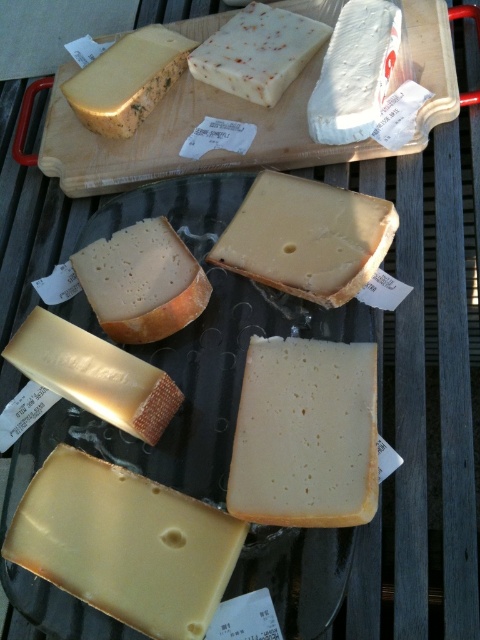
Is yellowish matte cheese at center-left above hard cheese at center?

Yes, yellowish matte cheese at center-left is above hard cheese at center.

Between yellowish matte cheese at center-left and hard cheese at center, which one has more height?

With more height is yellowish matte cheese at center-left.

Find the location of a particular element. The image size is (480, 640). yellowish matte cheese at center-left is located at coordinates (142, 282).

I want to click on yellowish matte cheese at center-left, so click(142, 282).

Does wooden cutting board at upper center have a greater height compared to golden hard cheese at upper left?

Yes, wooden cutting board at upper center is taller than golden hard cheese at upper left.

Which is above, wooden cutting board at upper center or golden hard cheese at upper left?

golden hard cheese at upper left

The height and width of the screenshot is (640, 480). I want to click on wooden cutting board at upper center, so click(x=182, y=138).

Locate an element on the screen. wooden cutting board at upper center is located at coordinates (182, 138).

Does point (269, 492) come farther from viewer compared to point (335, 116)?

No, (269, 492) is closer to viewer.

What do you see at coordinates (305, 435) in the screenshot? The height and width of the screenshot is (640, 480). I see `yellowish semi-hard cheese at center` at bounding box center [305, 435].

Where is `yellowish semi-hard cheese at center`? This screenshot has width=480, height=640. yellowish semi-hard cheese at center is located at coordinates (305, 435).